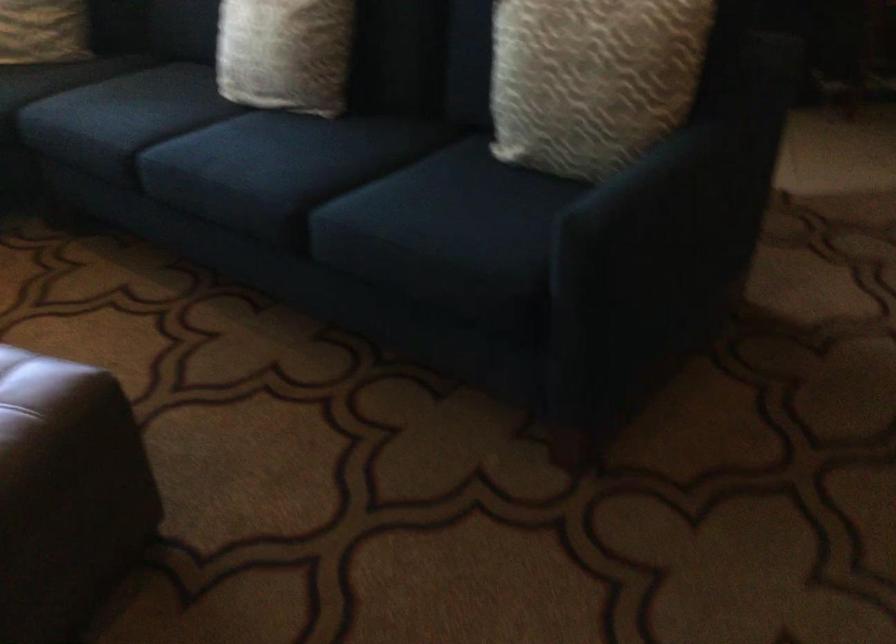
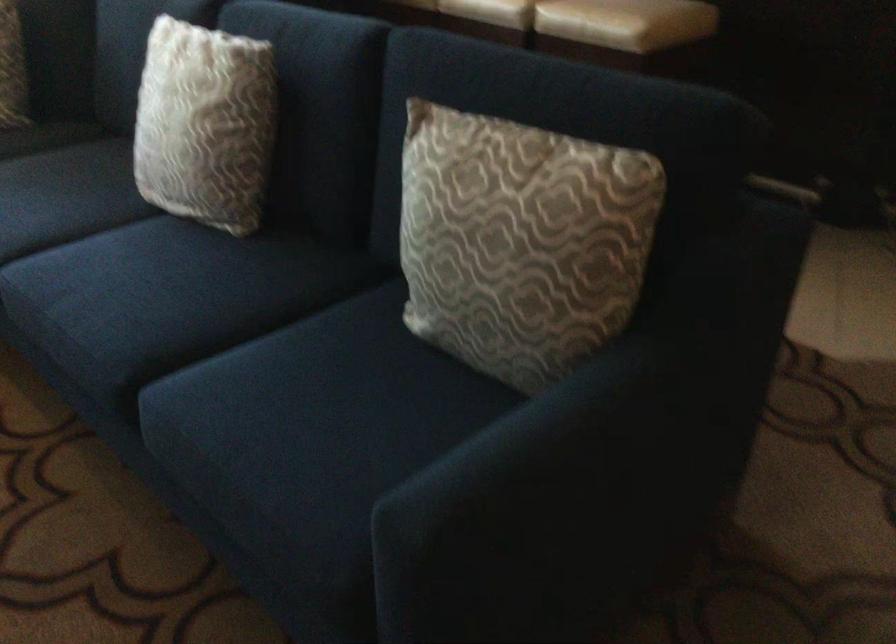
Question: The camera is either moving clockwise (left) or counter-clockwise (right) around the object. The first image is from the beginning of the video and the second image is from the end. Is the camera moving left or right when shooting the video?

Choices:
 (A) Left
 (B) Right

Answer: (B)